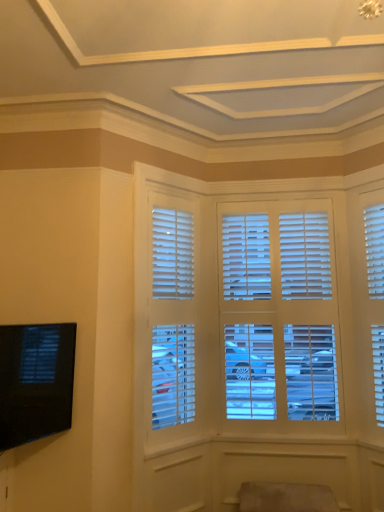
The width and height of the screenshot is (384, 512). Find the location of `white matte blinds at center`. white matte blinds at center is located at coordinates (174, 310).

Find the location of a particular element. The height and width of the screenshot is (512, 384). suede-like beige swivel chair at lower center is located at coordinates (286, 497).

The width and height of the screenshot is (384, 512). Identify the location of black glossy tv at lower left. (35, 381).

Are black glossy tv at lower left and white matte blinds at center far apart?

No, black glossy tv at lower left is not far from white matte blinds at center.

Based on their positions, is black glossy tv at lower left located to the left or right of white matte blinds at center?

black glossy tv at lower left is positioned on white matte blinds at center's left side.

You are a GUI agent. You are given a task and a screenshot of the screen. Output one action in this format:
    pyautogui.click(x=<x>, y=<y>)
    Task: Click on the television directly beneath the white matte blinds at center (from a real-world perspective)
    The image size is (384, 512).
    Given the screenshot: What is the action you would take?
    tap(35, 381)

Is black glossy tv at lower left positioned in front of white matte blinds at center?

Yes, it is in front of white matte blinds at center.

Does white matte blinds at center appear on the left side of black glossy tv at lower left?

Incorrect, white matte blinds at center is not on the left side of black glossy tv at lower left.

Does white matte blinds at center come behind black glossy tv at lower left?

Yes, white matte blinds at center is further from the viewer.

Can you tell me how much white matte blinds at center and black glossy tv at lower left differ in facing direction?

A: There is a 19.6-degree angle between the facing directions of white matte blinds at center and black glossy tv at lower left.

From a real-world perspective, which is physically above, white matte blinds at center or black glossy tv at lower left?

From a 3D spatial view, white matte blinds at center is above.

Is white matte blinds at center situated inside suede-like beige swivel chair at lower center or outside?

white matte blinds at center exists outside the volume of suede-like beige swivel chair at lower center.

Can you tell me how much white matte blinds at center and suede-like beige swivel chair at lower center differ in facing direction?

white matte blinds at center and suede-like beige swivel chair at lower center are facing 48.4 degrees away from each other.

Considering the sizes of objects white matte blinds at center and suede-like beige swivel chair at lower center in the image provided, who is taller, white matte blinds at center or suede-like beige swivel chair at lower center?

white matte blinds at center is taller.

Considering the sizes of objects black glossy tv at lower left and suede-like beige swivel chair at lower center in the image provided, who is shorter, black glossy tv at lower left or suede-like beige swivel chair at lower center?

Standing shorter between the two is suede-like beige swivel chair at lower center.

Can you confirm if black glossy tv at lower left is positioned to the left of suede-like beige swivel chair at lower center?

Yes, black glossy tv at lower left is to the left of suede-like beige swivel chair at lower center.

Considering the sizes of objects black glossy tv at lower left and suede-like beige swivel chair at lower center in the image provided, who is thinner, black glossy tv at lower left or suede-like beige swivel chair at lower center?

black glossy tv at lower left.

The height and width of the screenshot is (512, 384). Find the location of `television above the suede-like beige swivel chair at lower center (from the image's perspective)`. television above the suede-like beige swivel chair at lower center (from the image's perspective) is located at coordinates (x=35, y=381).

Is suede-like beige swivel chair at lower center directly adjacent to white matte blinds at center?

No.

Which of these two, suede-like beige swivel chair at lower center or white matte blinds at center, is bigger?

white matte blinds at center.

Between suede-like beige swivel chair at lower center and white matte blinds at center, which one is positioned in front?

Positioned in front is suede-like beige swivel chair at lower center.

Find the location of a particular element. Image resolution: width=384 pixels, height=512 pixels. swivel chair below the black glossy tv at lower left (from the image's perspective) is located at coordinates (286, 497).

Is the surface of suede-like beige swivel chair at lower center in direct contact with black glossy tv at lower left?

No, suede-like beige swivel chair at lower center is not touching black glossy tv at lower left.

Is suede-like beige swivel chair at lower center turned away from black glossy tv at lower left?

suede-like beige swivel chair at lower center does not have its back to black glossy tv at lower left.

Is point (300, 486) closer to camera compared to point (45, 402)?

That is False.

You are a GUI agent. You are given a task and a screenshot of the screen. Output one action in this format:
    pyautogui.click(x=<x>, y=<y>)
    Task: Click on the window that is above the black glossy tv at lower left (from a real-world perspective)
    This screenshot has height=512, width=384.
    Given the screenshot: What is the action you would take?
    pyautogui.click(x=174, y=310)

The image size is (384, 512). I want to click on television below the white matte blinds at center (from the image's perspective), so click(35, 381).

Based on their spatial positions, is suede-like beige swivel chair at lower center or black glossy tv at lower left closer to white matte blinds at center?

Based on the image, black glossy tv at lower left appears to be nearer to white matte blinds at center.

When comparing their distances from black glossy tv at lower left, does suede-like beige swivel chair at lower center or white matte blinds at center seem further?

suede-like beige swivel chair at lower center lies further to black glossy tv at lower left than the other object.

Looking at this image, estimate the real-world distances between objects in this image. Which object is further from suede-like beige swivel chair at lower center, white matte blinds at center or black glossy tv at lower left?

black glossy tv at lower left.

When comparing their distances from suede-like beige swivel chair at lower center, does black glossy tv at lower left or white matte blinds at center seem further?

black glossy tv at lower left lies further to suede-like beige swivel chair at lower center than the other object.

From the image, which object appears to be farther from white matte blinds at center, black glossy tv at lower left or suede-like beige swivel chair at lower center?

suede-like beige swivel chair at lower center lies further to white matte blinds at center than the other object.

Considering their positions, is white matte blinds at center positioned further to black glossy tv at lower left than suede-like beige swivel chair at lower center?

Based on the image, suede-like beige swivel chair at lower center appears to be further to black glossy tv at lower left.

This screenshot has width=384, height=512. What are the coordinates of `window between black glossy tv at lower left and suede-like beige swivel chair at lower center from left to right` in the screenshot? It's located at (174, 310).